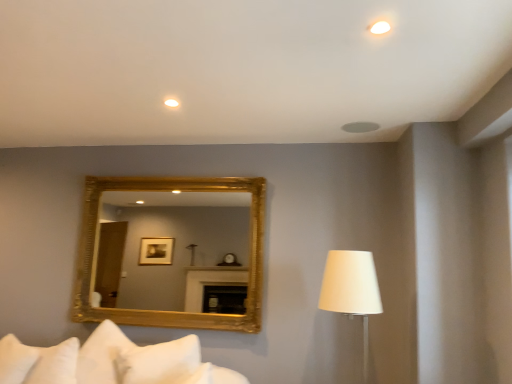
Question: Does white soft pillow at lower left, which is counted as the first pillow, starting from the right, have a greater width compared to white matte ceiling light at upper center, marked as the 2th lighting in a right-to-left arrangement?

Choices:
 (A) no
 (B) yes

Answer: (B)

Question: Does white soft pillow at lower left, which appears as the 2th pillow when viewed from the left, have a larger size compared to white matte ceiling light at upper center, the 2th lighting from the top?

Choices:
 (A) yes
 (B) no

Answer: (A)

Question: Would you say white soft pillow at lower left, which is counted as the first pillow, starting from the right, is a long distance from white matte ceiling light at upper center, the second lighting positioned from the front?

Choices:
 (A) no
 (B) yes

Answer: (B)

Question: From the image's perspective, is white soft pillow at lower left, which is counted as the first pillow, starting from the right, located above white matte ceiling light at upper center, marked as the 2th lighting in a right-to-left arrangement?

Choices:
 (A) yes
 (B) no

Answer: (B)

Question: Does white soft pillow at lower left, which is counted as the first pillow, starting from the right, lie behind white matte ceiling light at upper center, the 2th lighting from the top?

Choices:
 (A) no
 (B) yes

Answer: (A)

Question: Based on their sizes in the image, would you say white soft pillow at lower left, which appears as the 2th pillow when viewed from the left, is bigger or smaller than white fabric lampshade at right?

Choices:
 (A) big
 (B) small

Answer: (B)

Question: Is white soft pillow at lower left, which appears as the 2th pillow when viewed from the left, to the left or to the right of white fabric lampshade at right in the image?

Choices:
 (A) right
 (B) left

Answer: (B)

Question: From a real-world perspective, relative to white fabric lampshade at right, is white soft pillow at lower left, which is counted as the first pillow, starting from the right, vertically above or below?

Choices:
 (A) below
 (B) above

Answer: (A)

Question: Considering their positions, is white soft pillow at lower left, which is counted as the first pillow, starting from the right, located in front of or behind white fabric lampshade at right?

Choices:
 (A) front
 (B) behind

Answer: (B)

Question: Considering their positions, is white soft pillow at lower left, which appears as the 2th pillow when viewed from the left, located in front of or behind white soft pillow at lower left, which is counted as the 1th pillow, starting from the left?

Choices:
 (A) behind
 (B) front

Answer: (B)

Question: Visually, is white soft pillow at lower left, which is counted as the first pillow, starting from the right, positioned to the left or to the right of white soft pillow at lower left, which is counted as the 1th pillow, starting from the left?

Choices:
 (A) left
 (B) right

Answer: (B)

Question: Considering the positions of point (10, 377) and point (18, 382), is point (10, 377) closer or farther from the camera than point (18, 382)?

Choices:
 (A) closer
 (B) farther

Answer: (A)

Question: Is white soft pillow at lower left, which appears as the 2th pillow when viewed from the left, situated inside white soft pillow at lower left, which ranks as the second pillow in right-to-left order, or outside?

Choices:
 (A) outside
 (B) inside

Answer: (A)

Question: Is point (13, 344) closer or farther from the camera than point (367, 317)?

Choices:
 (A) closer
 (B) farther

Answer: (A)

Question: Considering the relative positions of white soft pillow at lower left, which ranks as the second pillow in right-to-left order, and white fabric lampshade at right in the image provided, is white soft pillow at lower left, which ranks as the second pillow in right-to-left order, to the left or to the right of white fabric lampshade at right?

Choices:
 (A) left
 (B) right

Answer: (A)